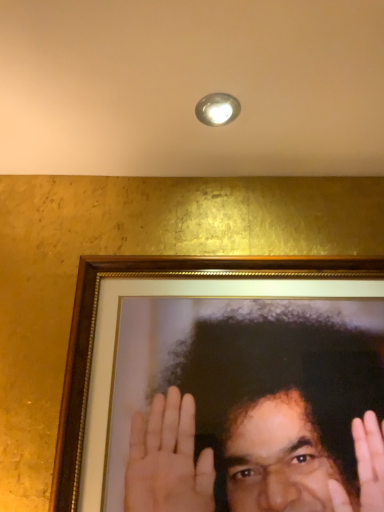
Question: Is the position of metallic dome at upper center more distant than that of smooth gold frame at center?

Choices:
 (A) yes
 (B) no

Answer: (A)

Question: Are metallic dome at upper center and smooth gold frame at center far apart?

Choices:
 (A) no
 (B) yes

Answer: (A)

Question: Is metallic dome at upper center completely or partially outside of smooth gold frame at center?

Choices:
 (A) yes
 (B) no

Answer: (A)

Question: Does metallic dome at upper center have a greater height compared to smooth gold frame at center?

Choices:
 (A) no
 (B) yes

Answer: (A)

Question: Is metallic dome at upper center thinner than smooth gold frame at center?

Choices:
 (A) no
 (B) yes

Answer: (A)

Question: From a real-world perspective, is metallic dome at upper center located higher than smooth gold frame at center?

Choices:
 (A) yes
 (B) no

Answer: (A)

Question: From a real-world perspective, is smooth gold frame at center positioned over metallic dome at upper center based on gravity?

Choices:
 (A) yes
 (B) no

Answer: (B)

Question: Can you confirm if smooth gold frame at center is thinner than metallic dome at upper center?

Choices:
 (A) no
 (B) yes

Answer: (B)

Question: Does smooth gold frame at center have a lesser height compared to metallic dome at upper center?

Choices:
 (A) no
 (B) yes

Answer: (A)

Question: Is the position of smooth gold frame at center more distant than that of metallic dome at upper center?

Choices:
 (A) yes
 (B) no

Answer: (B)

Question: From the image's perspective, does smooth gold frame at center appear lower than metallic dome at upper center?

Choices:
 (A) yes
 (B) no

Answer: (A)

Question: Is smooth gold frame at center oriented away from metallic dome at upper center?

Choices:
 (A) no
 (B) yes

Answer: (A)

Question: From the image's perspective, is metallic dome at upper center positioned above or below smooth gold frame at center?

Choices:
 (A) below
 (B) above

Answer: (B)